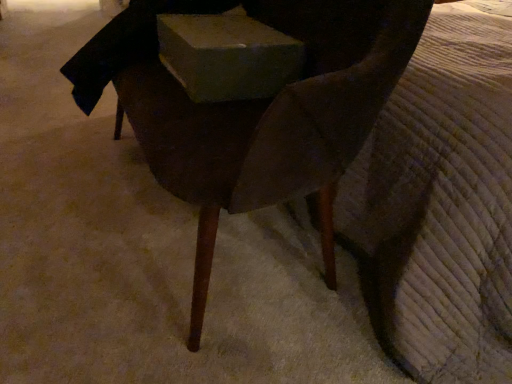
What do you see at coordinates (274, 121) in the screenshot?
I see `dark wood chair at center` at bounding box center [274, 121].

Identify the location of dark wood chair at center. (274, 121).

The height and width of the screenshot is (384, 512). I want to click on matte gray box at center, so click(x=227, y=56).

This screenshot has height=384, width=512. What do you see at coordinates (227, 56) in the screenshot? I see `matte gray box at center` at bounding box center [227, 56].

The image size is (512, 384). Find the location of `dark wood chair at center`. dark wood chair at center is located at coordinates pos(274,121).

Can you confirm if dark wood chair at center is positioned to the left of matte gray box at center?

Correct, you'll find dark wood chair at center to the left of matte gray box at center.

Which object is further away from the camera taking this photo, dark wood chair at center or matte gray box at center?

matte gray box at center is further from the camera.

Which is in front, point (251, 202) or point (219, 41)?

Positioned in front is point (251, 202).

From the image's perspective, which is above, dark wood chair at center or matte gray box at center?

matte gray box at center is shown above in the image.

From a real-world perspective, who is located higher, dark wood chair at center or matte gray box at center?

matte gray box at center.

Between dark wood chair at center and matte gray box at center, which one has smaller width?

Thinner between the two is matte gray box at center.

Which of these two, dark wood chair at center or matte gray box at center, stands taller?

With more height is dark wood chair at center.

Does dark wood chair at center have a larger size compared to matte gray box at center?

Yes.

Could matte gray box at center be considered to be inside dark wood chair at center?

Yes, dark wood chair at center is surrounding matte gray box at center.

Are dark wood chair at center and matte gray box at center located far from each other?

No, dark wood chair at center is not far from matte gray box at center.

Is dark wood chair at center facing away from matte gray box at center?

Yes, dark wood chair at center is facing away from matte gray box at center.

Locate an element on the screen. box that appears on the right of dark wood chair at center is located at coordinates (227, 56).

Consider the image. Is matte gray box at center at the right side of dark wood chair at center?

Yes.

Is matte gray box at center closer to camera compared to dark wood chair at center?

No, it is not.

Considering the points (202, 28) and (365, 36), which point is in front, point (202, 28) or point (365, 36)?

The point (365, 36) is in front.

From the image's perspective, is matte gray box at center beneath dark wood chair at center?

Incorrect, from the image's perspective, matte gray box at center is higher than dark wood chair at center.

From a real-world perspective, which is physically above, matte gray box at center or dark wood chair at center?

In real-world perspective, matte gray box at center is above.

Considering the sizes of objects matte gray box at center and dark wood chair at center in the image provided, who is wider, matte gray box at center or dark wood chair at center?

dark wood chair at center.

In terms of height, does matte gray box at center look taller or shorter compared to dark wood chair at center?

Considering their sizes, matte gray box at center has less height than dark wood chair at center.

From the picture: Which of these two, matte gray box at center or dark wood chair at center, is bigger?

With larger size is dark wood chair at center.

Is dark wood chair at center completely or partially inside matte gray box at center?

No, dark wood chair at center is located outside of matte gray box at center.

Is matte gray box at center in contact with dark wood chair at center?

matte gray box at center and dark wood chair at center are not in contact.

Is matte gray box at center facing towards dark wood chair at center?

Yes, matte gray box at center is oriented towards dark wood chair at center.

How many degrees apart are the facing directions of matte gray box at center and dark wood chair at center?

The angle between the facing direction of matte gray box at center and the facing direction of dark wood chair at center is 0.00156 degrees.

How much distance is there between matte gray box at center and dark wood chair at center?

matte gray box at center is 6.86 inches away from dark wood chair at center.

There is a dark wood chair at center. Where is `box above it (from a real-world perspective)`? The height and width of the screenshot is (384, 512). box above it (from a real-world perspective) is located at coordinates (227, 56).

Locate an element on the screen. The width and height of the screenshot is (512, 384). box above the dark wood chair at center (from the image's perspective) is located at coordinates (227, 56).

Where is `chair located in front of the matte gray box at center`? This screenshot has height=384, width=512. chair located in front of the matte gray box at center is located at coordinates (274, 121).